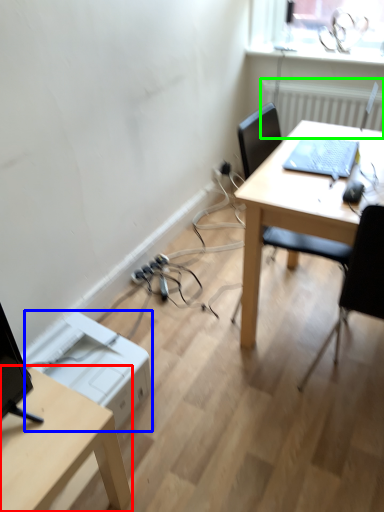
Question: Which is nearer to the desk (highlighted by a red box)? printer (highlighted by a blue box) or radiator (highlighted by a green box).

Choices:
 (A) printer
 (B) radiator

Answer: (A)